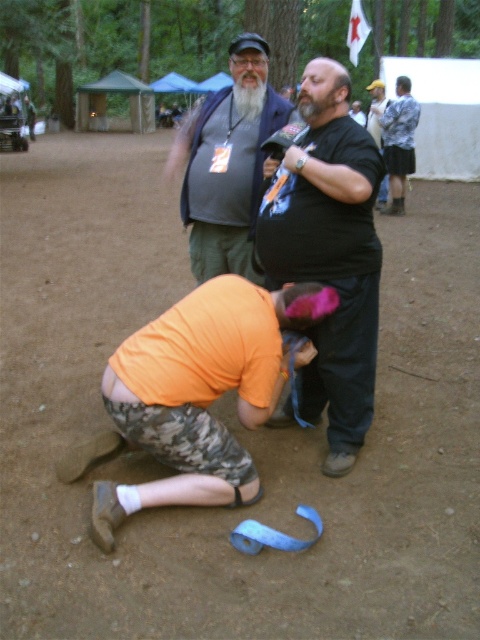
Question: Which object is positioned farthest from the matte gray vest at center?

Choices:
 (A) orange fabric at lower center
 (B) black matte shirt at center

Answer: (B)

Question: Which object appears closest to the camera in this image?

Choices:
 (A) black matte shirt at center
 (B) matte gray vest at center

Answer: (A)

Question: Estimate the real-world distances between objects in this image. Which object is farther from the matte gray vest at center?

Choices:
 (A) orange fabric at lower center
 (B) black matte shirt at center

Answer: (B)

Question: Does black matte shirt at center have a smaller size compared to matte gray vest at center?

Choices:
 (A) yes
 (B) no

Answer: (A)

Question: Does orange fabric at lower center appear on the left side of black matte shirt at center?

Choices:
 (A) no
 (B) yes

Answer: (B)

Question: Can you confirm if black matte shirt at center is positioned to the right of matte gray vest at center?

Choices:
 (A) no
 (B) yes

Answer: (B)